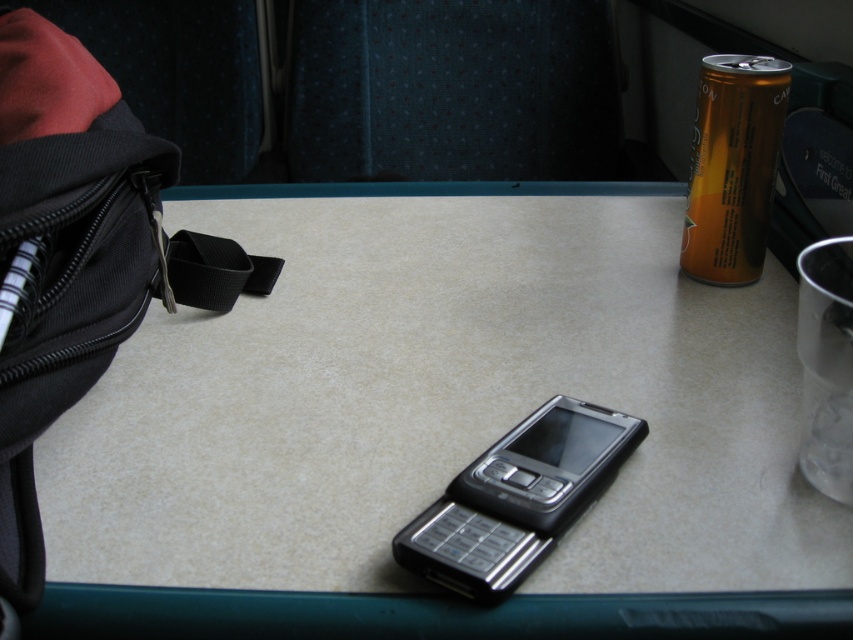
Question: Can you confirm if matte plastic phone at center is thinner than black fabric bag at left?

Choices:
 (A) yes
 (B) no

Answer: (B)

Question: Considering the real-world distances, which object is closest to the orange aluminum can at upper right?

Choices:
 (A) matte plastic phone at center
 (B) silver metallic smartphone at center
 (C) black fabric bag at left

Answer: (A)

Question: Can you confirm if matte plastic phone at center is positioned above silver metallic smartphone at center?

Choices:
 (A) yes
 (B) no

Answer: (A)

Question: Does matte plastic phone at center have a greater width compared to orange aluminum can at upper right?

Choices:
 (A) no
 (B) yes

Answer: (B)

Question: Among these objects, which one is nearest to the camera?

Choices:
 (A) black fabric bag at left
 (B) silver metallic smartphone at center
 (C) orange aluminum can at upper right

Answer: (A)

Question: Which of these objects is positioned farthest from the orange aluminum can at upper right?

Choices:
 (A) matte plastic phone at center
 (B) black fabric bag at left
 (C) silver metallic smartphone at center

Answer: (B)